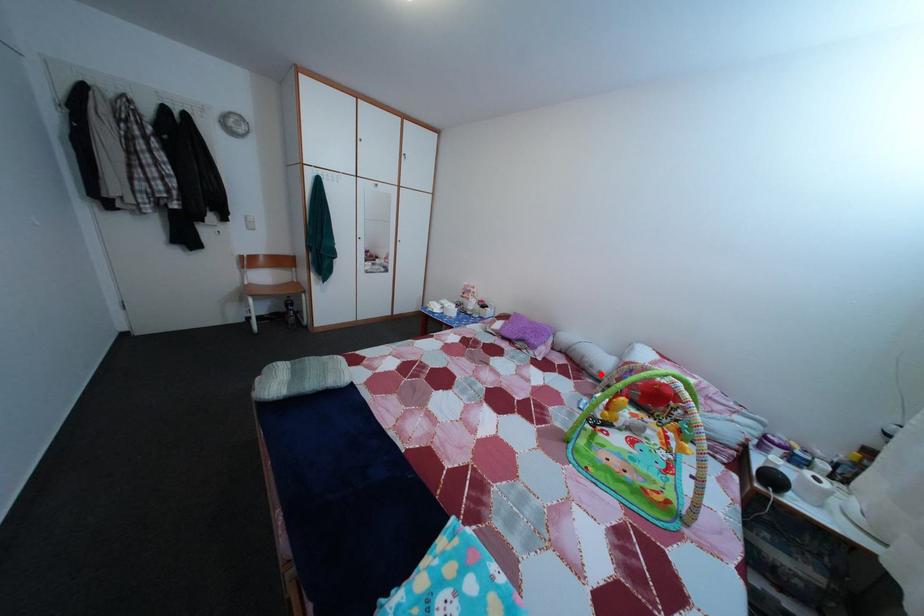
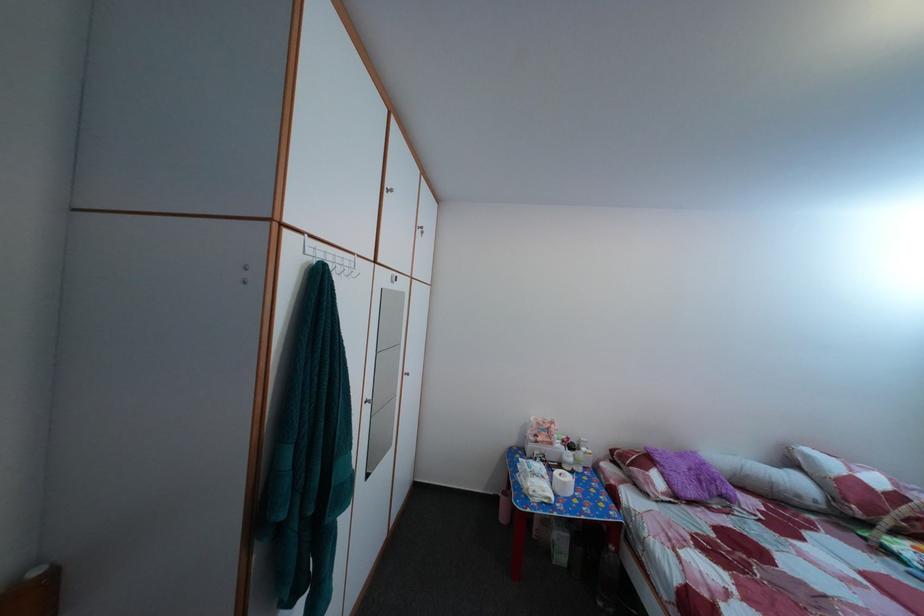
Find the pixel in the second image that matches the highlighted location in the first image.

(808, 504)